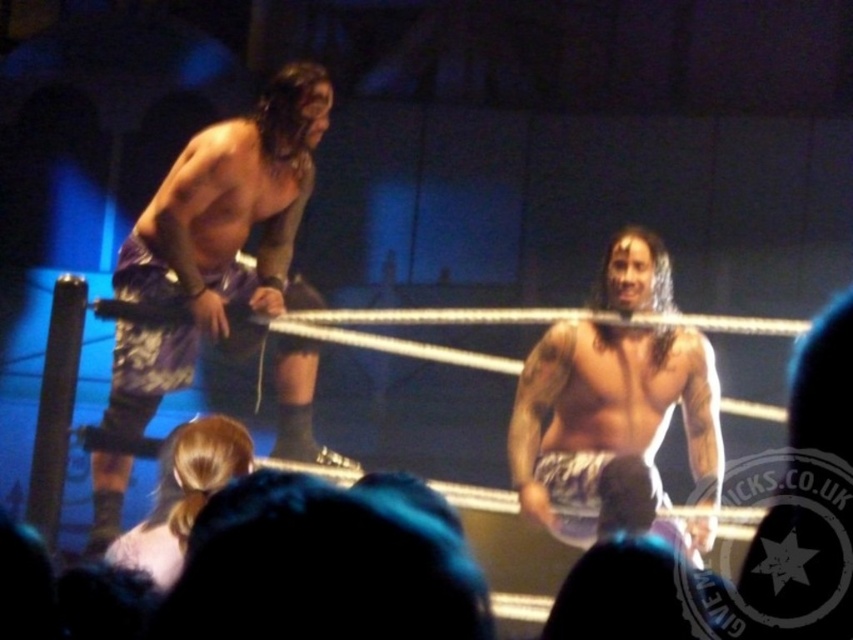
You are a referee in the wrestling match and need to ensure that the purple fabric shorts at left and the shiny metallic shorts at center are visible to the audience. Which pair of shorts should you adjust to avoid covering the other?

The purple fabric shorts at left is positioned over shiny metallic shorts at center, so you should adjust the purple fabric shorts at left to move it aside so the shiny metallic shorts at center can be seen.

What is the exact coordinate of the tattooed skin at center?

The tattooed skin at center is located at point (x=614, y=392).

The scene shows two wrestlers in an arena. There is a point at coordinates (x=215, y=240). What object is located at this point?

The point at coordinates (x=215, y=240) indicates purple fabric shorts at left.